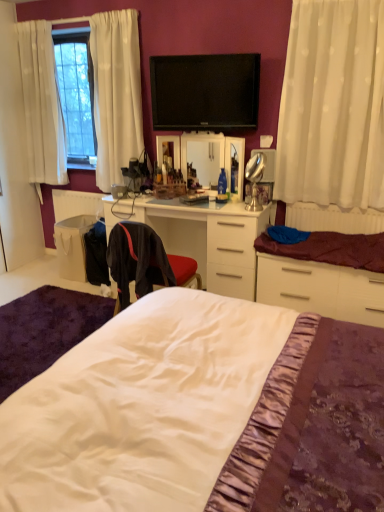
Question: In terms of width, does white plastic radiator at right look wider or thinner when compared to white fabric bag at lower left?

Choices:
 (A) wide
 (B) thin

Answer: (B)

Question: From a real-world perspective, is white plastic radiator at right above or below white fabric bag at lower left?

Choices:
 (A) below
 (B) above

Answer: (B)

Question: Estimate the real-world distances between objects in this image. Which object is closer to the matte white mirror at center?

Choices:
 (A) white plastic radiator at right
 (B) white sheer curtain at right
 (C) black fabric chair at center
 (D) silver metallic table lamp at center
 (E) white matte cabinet at right

Answer: (D)

Question: Which is nearer to the matte white mirror at center?

Choices:
 (A) flat screen tv at upper center
 (B) silver metallic table lamp at center
 (C) black fabric chair at center
 (D) white glossy desk at center
 (E) maroon satin blanket at right

Answer: (B)